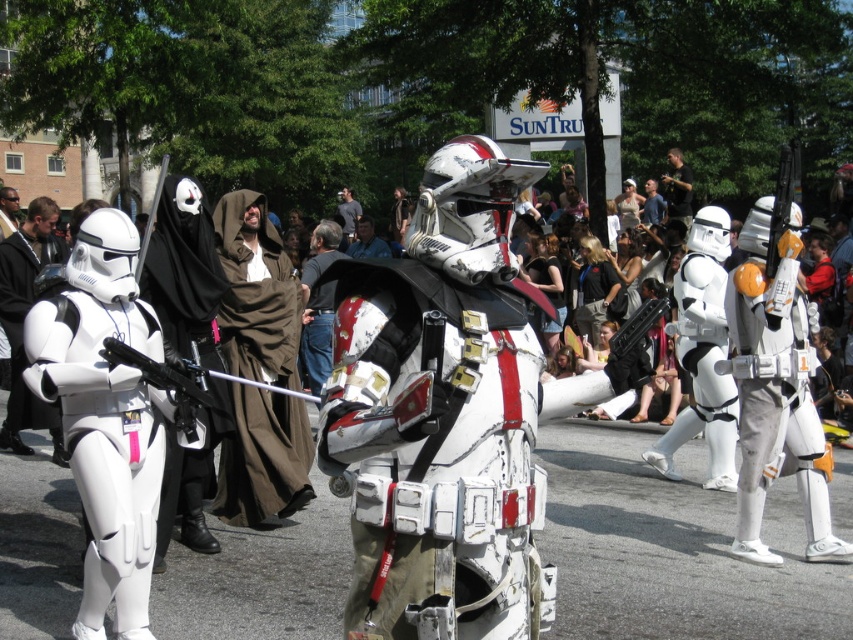
Question: Does white matte stormtrooper armor at left appear on the left side of blue fabric shirt at center?

Choices:
 (A) no
 (B) yes

Answer: (B)

Question: Which object appears farthest from the camera in this image?

Choices:
 (A) blue fabric shirt at center
 (B) matte black helmet at upper left
 (C) dark brown leather jacket at center
 (D) brown fabric robe at center

Answer: (C)

Question: Is white matte stormtrooper armor at left above black cotton shirt at center?

Choices:
 (A) no
 (B) yes

Answer: (A)

Question: Is black cotton shirt at center wider than blue fabric shirt at center?

Choices:
 (A) no
 (B) yes

Answer: (A)

Question: Among these points, which one is farthest from the camera?

Choices:
 (A) (357, 218)
 (B) (669, 154)
 (C) (242, 365)
 (D) (650, 193)

Answer: (A)

Question: Which of the following is the closest to the observer?

Choices:
 (A) (395, 589)
 (B) (318, 246)

Answer: (A)